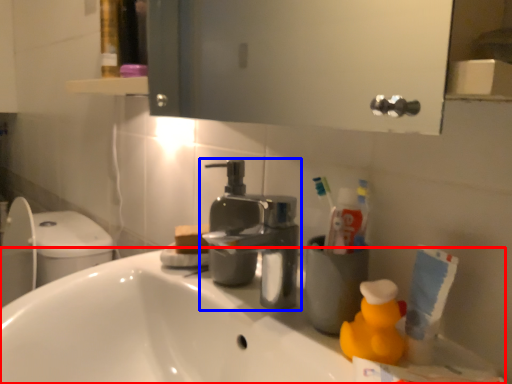
Question: Which object is further to the camera taking this photo, counter top (highlighted by a red box) or tap (highlighted by a blue box)?

Choices:
 (A) counter top
 (B) tap

Answer: (B)